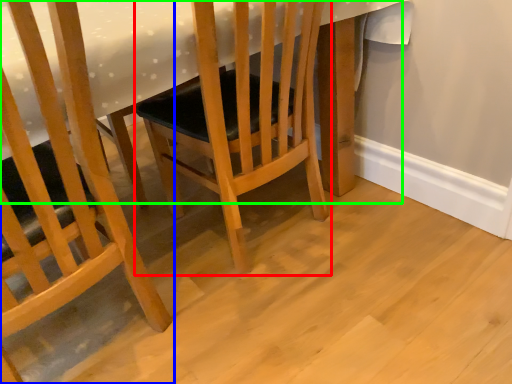
Question: Considering the real-world distances, which object is closest to chair (highlighted by a red box)? chair (highlighted by a blue box) or table (highlighted by a green box).

Choices:
 (A) chair
 (B) table

Answer: (B)